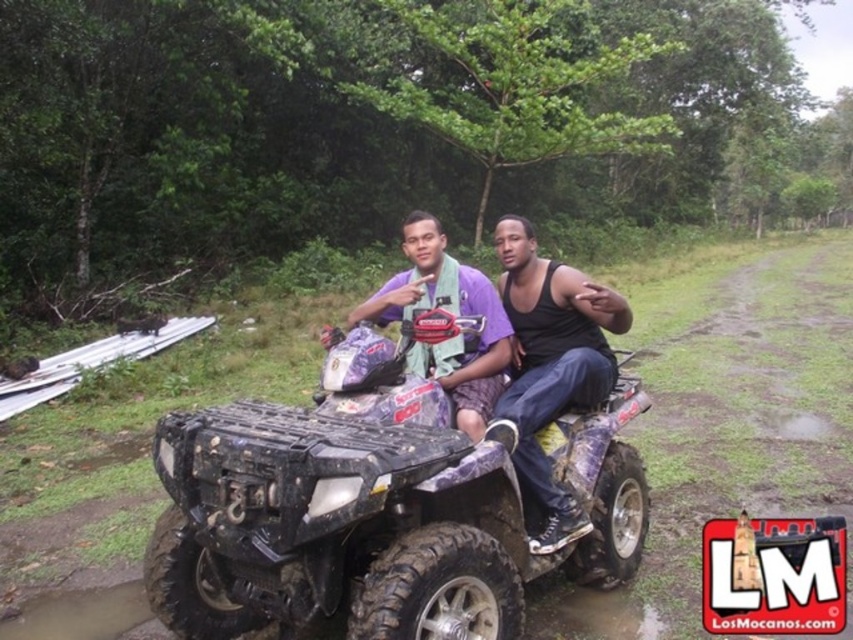
Question: Which point is farther to the camera?

Choices:
 (A) matte purple quad bike at center
 (B) purple matte shirt at center

Answer: (B)

Question: Is matte purple quad bike at center to the right of purple matte shirt at center from the viewer's perspective?

Choices:
 (A) no
 (B) yes

Answer: (B)

Question: Which of these objects is positioned farthest from the purple matte shirt at center?

Choices:
 (A) matte purple quad bike at center
 (B) black matte tank top at center

Answer: (B)

Question: Is matte purple quad bike at center smaller than black matte tank top at center?

Choices:
 (A) yes
 (B) no

Answer: (B)

Question: From the image, what is the correct spatial relationship of matte purple quad bike at center in relation to purple matte shirt at center?

Choices:
 (A) right
 (B) left

Answer: (A)

Question: Which object is farther from the camera taking this photo?

Choices:
 (A) black matte tank top at center
 (B) purple matte shirt at center

Answer: (B)